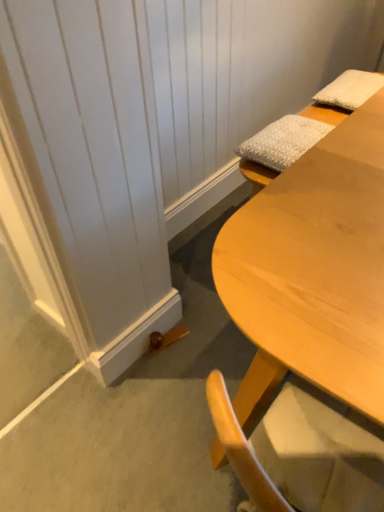
What do you see at coordinates (283, 141) in the screenshot?
I see `white textured pillow at upper right, which is the second pillow in top-to-bottom order` at bounding box center [283, 141].

Locate an element on the screen. The image size is (384, 512). white textured pillow at upper right, which is the second pillow in top-to-bottom order is located at coordinates (283, 141).

Locate an element on the screen. white textured pillow at upper right, positioned as the first pillow in right-to-left order is located at coordinates (350, 89).

Identify the location of white textured pillow at upper right, the first pillow positioned from the left. (283, 141).

Based on the photo, is white textured pillow at upper right, which is the second pillow in top-to-bottom order, not near light wood desk at lower right?

white textured pillow at upper right, which is the second pillow in top-to-bottom order, is actually quite close to light wood desk at lower right.

Considering the positions of objects white textured pillow at upper right, the second pillow when ordered from back to front, and light wood desk at lower right in the image provided, who is more to the left, white textured pillow at upper right, the second pillow when ordered from back to front, or light wood desk at lower right?

Positioned to the left is light wood desk at lower right.

From the image's perspective, is white textured pillow at upper right, the second pillow when ordered from back to front, beneath light wood desk at lower right?

Incorrect, from the image's perspective, white textured pillow at upper right, the second pillow when ordered from back to front, is higher than light wood desk at lower right.

Is white textured pillow at upper right, the 1th pillow when ordered from bottom to top, completely or partially outside of light wood desk at lower right?

That's correct, white textured pillow at upper right, the 1th pillow when ordered from bottom to top, is outside of light wood desk at lower right.

Is point (306, 221) positioned behind point (239, 153)?

No, (306, 221) is closer to viewer.

From the image's perspective, is light wood desk at lower right below white textured pillow at upper right, the 1th pillow when ordered from bottom to top?

Yes, from the image's perspective, light wood desk at lower right is below white textured pillow at upper right, the 1th pillow when ordered from bottom to top.

Considering their positions, is light wood desk at lower right located in front of or behind white textured pillow at upper right, the 1th pillow when ordered from bottom to top?

Visually, light wood desk at lower right is located in front of white textured pillow at upper right, the 1th pillow when ordered from bottom to top.

Based on the photo, which is correct: light wood desk at lower right is inside white textured pillow at upper right, the 1th pillow when ordered from bottom to top, or outside of it?

light wood desk at lower right is not inside white textured pillow at upper right, the 1th pillow when ordered from bottom to top, it's outside.

Is white textured pillow at upper right, the second pillow in the left-to-right sequence, facing towards white textured pillow at upper right, the first pillow in the front-to-back sequence?

No, white textured pillow at upper right, the second pillow in the left-to-right sequence, is not aimed at white textured pillow at upper right, the first pillow in the front-to-back sequence.

From the image's perspective, does white textured pillow at upper right, the second pillow in the left-to-right sequence, appear higher than white textured pillow at upper right, which is the 2th pillow from right to left?

Yes, from the image's perspective, white textured pillow at upper right, the second pillow in the left-to-right sequence, is on top of white textured pillow at upper right, which is the 2th pillow from right to left.

Can you confirm if white textured pillow at upper right, positioned as the 2th pillow in front-to-back order, is thinner than white textured pillow at upper right, the first pillow in the front-to-back sequence?

No.

Looking at the image, does white textured pillow at upper right, positioned as the 2th pillow in front-to-back order, seem bigger or smaller compared to light wood desk at lower right?

In the image, white textured pillow at upper right, positioned as the 2th pillow in front-to-back order, appears to be smaller than light wood desk at lower right.

From a real-world perspective, which object stands above the other?

In real-world perspective, white textured pillow at upper right, the first pillow from the top, is above.

Is white textured pillow at upper right, positioned as the first pillow in right-to-left order, closer to camera compared to light wood desk at lower right?

No, it is behind light wood desk at lower right.

Is white textured pillow at upper right, the second pillow in the left-to-right sequence, aimed at light wood desk at lower right?

No.

Would you say white textured pillow at upper right, which is the 2th pillow from right to left, contains white textured pillow at upper right, the second pillow in the left-to-right sequence?

No, white textured pillow at upper right, the second pillow in the left-to-right sequence, is not inside white textured pillow at upper right, which is the 2th pillow from right to left.

Is white textured pillow at upper right, which is the second pillow in top-to-bottom order, in front of or behind white textured pillow at upper right, positioned as the first pillow in right-to-left order, in the image?

white textured pillow at upper right, which is the second pillow in top-to-bottom order, is in front of white textured pillow at upper right, positioned as the first pillow in right-to-left order.

Measure the distance from white textured pillow at upper right, the first pillow in the front-to-back sequence, to white textured pillow at upper right, the second pillow in the left-to-right sequence.

white textured pillow at upper right, the first pillow in the front-to-back sequence, is 12.36 inches from white textured pillow at upper right, the second pillow in the left-to-right sequence.

Which is in front, point (278, 362) or point (324, 103)?

Positioned in front is point (278, 362).

Are light wood desk at lower right and white textured pillow at upper right, the second pillow in the left-to-right sequence, far apart?

Actually, light wood desk at lower right and white textured pillow at upper right, the second pillow in the left-to-right sequence, are a little close together.

Locate an element on the screen. This screenshot has width=384, height=512. desk that is under the white textured pillow at upper right, arranged as the second pillow when ordered from the bottom (from a real-world perspective) is located at coordinates (313, 270).

From a real-world perspective, is light wood desk at lower right positioned above or below white textured pillow at upper right, positioned as the first pillow in right-to-left order?

In terms of real-world spatial position, light wood desk at lower right is below white textured pillow at upper right, positioned as the first pillow in right-to-left order.

Find the location of a particular element. desk that appears on the left of white textured pillow at upper right, the first pillow positioned from the left is located at coordinates (313, 270).

From the image's perspective, count 1st pillows upward from the light wood desk at lower right and point to it. Please provide its 2D coordinates.

[(283, 141)]

When comparing their distances from white textured pillow at upper right, the second pillow when ordered from back to front, does white textured pillow at upper right, arranged as the second pillow when ordered from the bottom, or light wood desk at lower right seem further?

Among the two, light wood desk at lower right is located further to white textured pillow at upper right, the second pillow when ordered from back to front.

Estimate the real-world distances between objects in this image. Which object is closer to white textured pillow at upper right, the second pillow in the left-to-right sequence, white textured pillow at upper right, the first pillow in the front-to-back sequence, or light wood desk at lower right?

Based on the image, white textured pillow at upper right, the first pillow in the front-to-back sequence, appears to be nearer to white textured pillow at upper right, the second pillow in the left-to-right sequence.

Estimate the real-world distances between objects in this image. Which object is closer to light wood desk at lower right, white textured pillow at upper right, positioned as the 2th pillow in front-to-back order, or white textured pillow at upper right, which is the 2th pillow from right to left?

white textured pillow at upper right, which is the 2th pillow from right to left, is positioned closer to the anchor light wood desk at lower right.

Considering their positions, is white textured pillow at upper right, the 1th pillow when ordered from bottom to top, positioned further to light wood desk at lower right than white textured pillow at upper right, acting as the 1th pillow starting from the back?

Among the two, white textured pillow at upper right, acting as the 1th pillow starting from the back, is located further to light wood desk at lower right.

Based on their spatial positions, is light wood desk at lower right or white textured pillow at upper right, positioned as the 2th pillow in front-to-back order, closer to white textured pillow at upper right, which is the 2th pillow from right to left?

The object closer to white textured pillow at upper right, which is the 2th pillow from right to left, is white textured pillow at upper right, positioned as the 2th pillow in front-to-back order.

Which object lies nearer to the anchor point white textured pillow at upper right, positioned as the 2th pillow in front-to-back order, light wood desk at lower right or white textured pillow at upper right, the second pillow when ordered from back to front?

white textured pillow at upper right, the second pillow when ordered from back to front, is positioned closer to the anchor white textured pillow at upper right, positioned as the 2th pillow in front-to-back order.

Where is `pillow between light wood desk at lower right and white textured pillow at upper right, positioned as the 2th pillow in front-to-back order, along the z-axis`? pillow between light wood desk at lower right and white textured pillow at upper right, positioned as the 2th pillow in front-to-back order, along the z-axis is located at coordinates (283, 141).